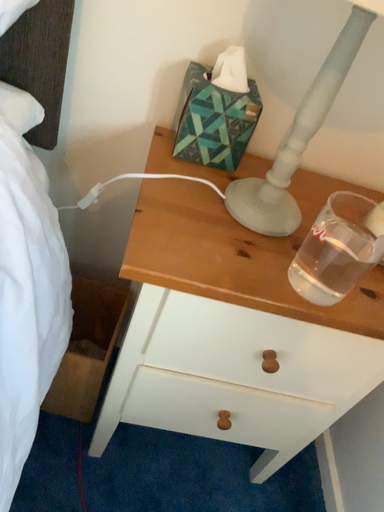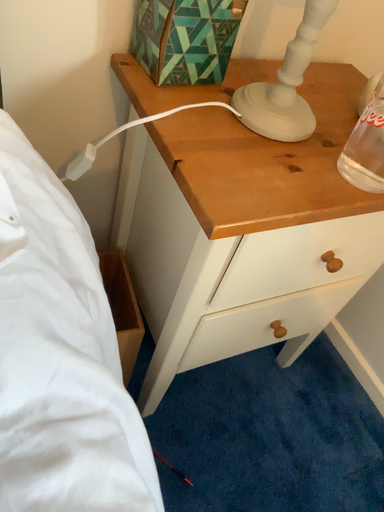
Question: Which way did the camera rotate in the video?

Choices:
 (A) rotated upward
 (B) rotated downward

Answer: (B)